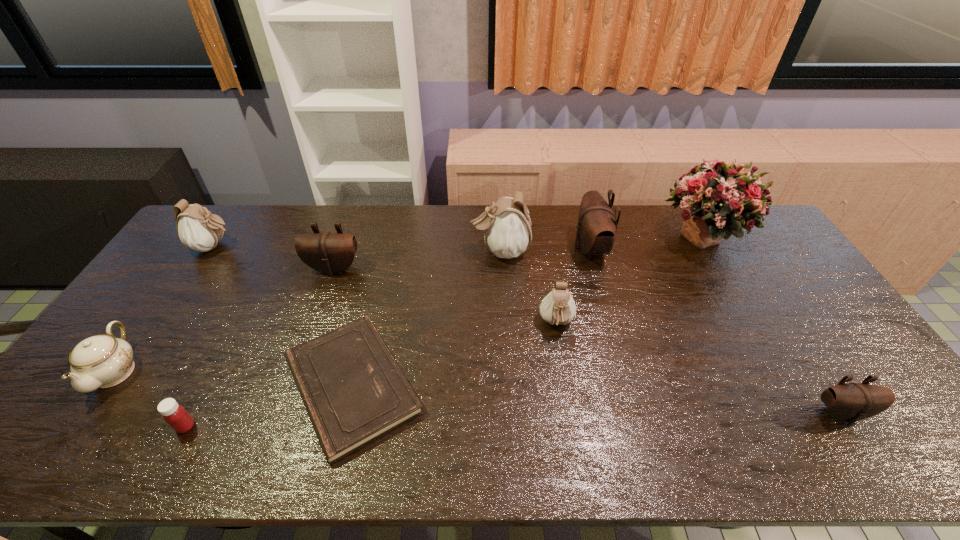
Locate an element on the screen. The height and width of the screenshot is (540, 960). brown pouch that is the third nearest to the biggest white pouch is located at coordinates (851, 402).

Identify the location of free spot that satisfies the following two spatial constraints: 1. on the front-facing side of the biggest white pouch; 2. with the flap open on the second biggest brown pouch. (501, 268).

Where is `free space that satisfies the following two spatial constraints: 1. on the front-facing side of the biggest white pouch; 2. on the front side of the paperback book`? This screenshot has width=960, height=540. free space that satisfies the following two spatial constraints: 1. on the front-facing side of the biggest white pouch; 2. on the front side of the paperback book is located at coordinates (507, 385).